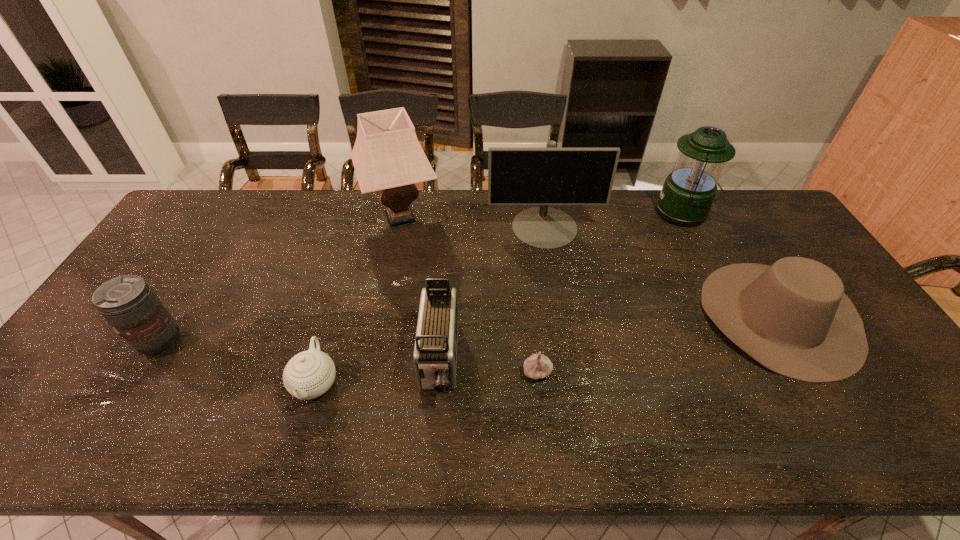
Locate an element on the screen. This screenshot has height=540, width=960. vacant area at the near edge is located at coordinates (365, 448).

Identify the location of free space at the right edge of the desktop. (x=812, y=258).

Identify the location of vacant region at the far left corner. (194, 215).

Identify the location of free space at the far right corner of the desktop. (739, 221).

I want to click on empty space that is in between the shortest object and the cowboy hat, so click(x=659, y=344).

Locate an element on the screen. The image size is (960, 540). vacant area between the leftmost object and the chinaware is located at coordinates (239, 363).

Locate an element on the screen. The width and height of the screenshot is (960, 540). vacant space in between the lampshade and the third shortest object is located at coordinates coord(590,267).

Find the location of `free space between the chinaware and the sixth tallest object`. free space between the chinaware and the sixth tallest object is located at coordinates (547, 349).

This screenshot has height=540, width=960. I want to click on vacant area that lies between the leftmost object and the second shortest object, so click(239, 363).

In order to click on vacant point located between the computer monitor and the cowboy hat in this screenshot , I will do point(662,272).